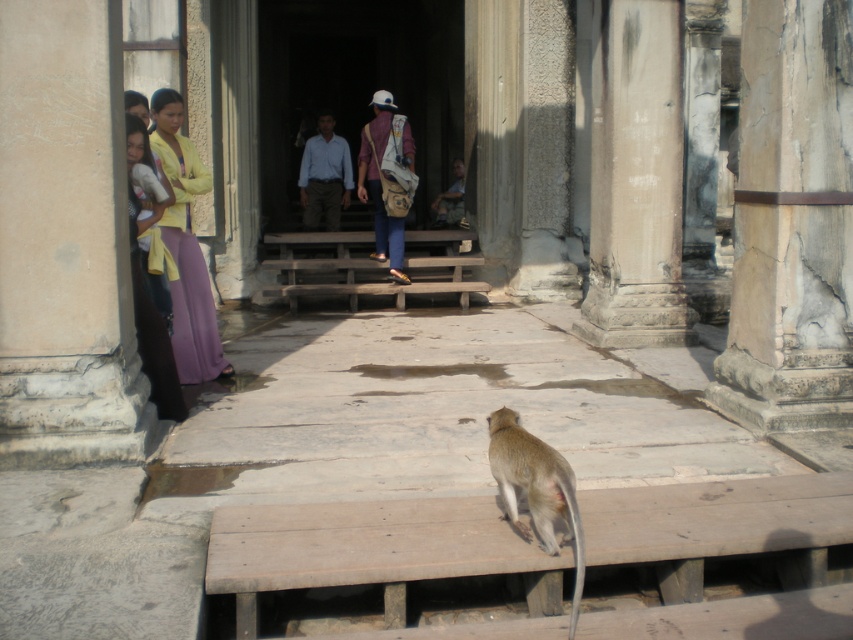
Question: Which of these objects is positioned farthest from the matte yellow shirt at left?

Choices:
 (A) light brown fur monkey at lower center
 (B) gray stone pillar at center
 (C) beige canvas backpack at center

Answer: (C)

Question: Does white stone column at right have a greater width compared to light blue shirt at center?

Choices:
 (A) yes
 (B) no

Answer: (B)

Question: In this image, where is gray stone pillar at center located relative to light brown fur monkey at lower center?

Choices:
 (A) below
 (B) above

Answer: (B)

Question: In this image, where is purple silk pants at left located relative to light blue shirt at center?

Choices:
 (A) above
 (B) below

Answer: (B)

Question: Which point is closer to the camera?

Choices:
 (A) gray stone pillar at center
 (B) purple silk pants at left
 (C) matte yellow shirt at left

Answer: (C)

Question: Based on their relative distances, which object is farther from the gray stone pillar at center?

Choices:
 (A) light brown fur monkey at lower center
 (B) white stone column at right
 (C) matte yellow shirt at left
 (D) beige stone pillar at upper left

Answer: (D)